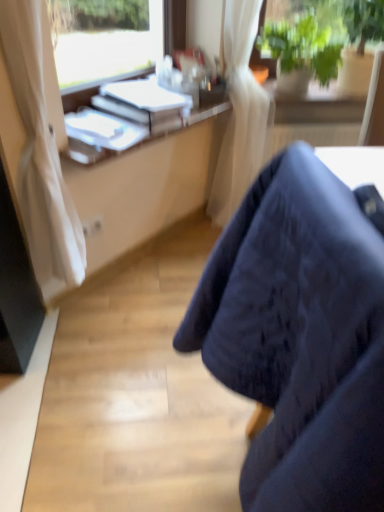
Find the location of a particular element. The height and width of the screenshot is (512, 384). free spot above white glossy book at upper left, arranged as the second book when viewed from the top (from a real-world perspective) is located at coordinates (101, 125).